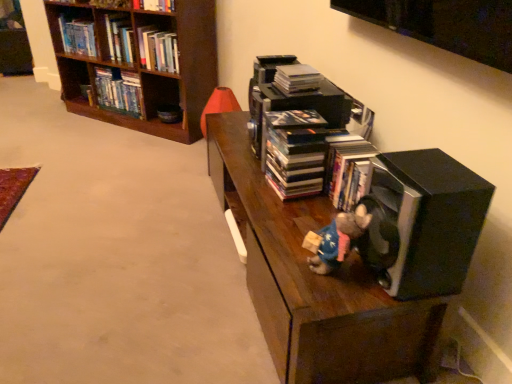
Find the location of a particular element. This screenshot has height=384, width=512. black matte book at center, positioned as the 4th book in top-to-bottom order is located at coordinates (303, 152).

At what (x,y) coordinates should I click in order to perform the action: click on hardcover book at upper left, the second book from the front. Please return your answer as a coordinate pair (x, y). This screenshot has height=384, width=512. Looking at the image, I should click on (158, 50).

What do you see at coordinates (78, 36) in the screenshot? This screenshot has width=512, height=384. I see `hardcover book at upper left, the 1th book positioned from the left` at bounding box center [78, 36].

How much space does hardcover books at left, which is counted as the second book, starting from the left, occupy horizontally?

hardcover books at left, which is counted as the second book, starting from the left, is 20.45 centimeters in width.

Identify the location of hardcover books at left, positioned as the third book in front-to-back order. This screenshot has width=512, height=384. (119, 91).

What do you see at coordinates (316, 284) in the screenshot? This screenshot has height=384, width=512. I see `dark wood shelf at center` at bounding box center [316, 284].

The height and width of the screenshot is (384, 512). Describe the element at coordinates (338, 240) in the screenshot. I see `plush toy at center` at that location.

Identify the location of plush toy at center. Image resolution: width=512 pixels, height=384 pixels. [x=338, y=240].

In order to click on brown wooden bookcase at upper left in this screenshot , I will do `click(137, 62)`.

I want to click on black matte book at center, which appears as the first book when viewed from the right, so click(303, 152).

Does hardcover book at upper left, which is counted as the first book, starting from the back, lie behind hardcover book at upper left, which is counted as the 3th book, starting from the left?

Yes, hardcover book at upper left, which is counted as the first book, starting from the back, is behind hardcover book at upper left, which is counted as the 3th book, starting from the left.

Does hardcover book at upper left, which is counted as the first book, starting from the back, have a lesser width compared to hardcover book at upper left, the second book from the front?

Incorrect, the width of hardcover book at upper left, which is counted as the first book, starting from the back, is not less than that of hardcover book at upper left, the second book from the front.

Where is `the 2nd book counting from the right of the hardcover book at upper left, arranged as the fourth book when viewed from the front`? This screenshot has height=384, width=512. the 2nd book counting from the right of the hardcover book at upper left, arranged as the fourth book when viewed from the front is located at coordinates [x=158, y=50].

Looking at this image, can you confirm if hardcover book at upper left, which ranks as the 1th book in top-to-bottom order, is bigger than hardcover book at upper left, the second book from the front?

Correct, hardcover book at upper left, which ranks as the 1th book in top-to-bottom order, is larger in size than hardcover book at upper left, the second book from the front.

Does dark wood shelf at center have a lesser height compared to black matte speaker at lower right?

In fact, dark wood shelf at center may be taller than black matte speaker at lower right.

Do you think dark wood shelf at center is within black matte speaker at lower right, or outside of it?

dark wood shelf at center is outside black matte speaker at lower right.

Which object is closer to the camera, dark wood shelf at center or black matte speaker at lower right?

black matte speaker at lower right is more forward.

Is dark wood shelf at center to the left or to the right of black matte speaker at lower right in the image?

From the image, it's evident that dark wood shelf at center is to the left of black matte speaker at lower right.

Which is in front, point (129, 80) or point (445, 279)?

Point (445, 279)

Considering the relative sizes of brown wooden bookcase at upper left and black matte speaker at lower right in the image provided, is brown wooden bookcase at upper left shorter than black matte speaker at lower right?

No, brown wooden bookcase at upper left is not shorter than black matte speaker at lower right.

From a real-world perspective, is brown wooden bookcase at upper left physically located above or below black matte speaker at lower right?

From a real-world perspective, brown wooden bookcase at upper left is physically below black matte speaker at lower right.

Is brown wooden bookcase at upper left facing towards black matte speaker at lower right?

No, brown wooden bookcase at upper left is not oriented towards black matte speaker at lower right.

Is black matte book at center, which is the 4th book in back-to-front order, not inside hardcover book at upper left, which is counted as the first book, starting from the back?

Yes, black matte book at center, which is the 4th book in back-to-front order, is located beyond the bounds of hardcover book at upper left, which is counted as the first book, starting from the back.

Can you confirm if black matte book at center, which is the fourth book in left-to-right order, is smaller than hardcover book at upper left, which ranks as the 4th book in right-to-left order?

Yes, black matte book at center, which is the fourth book in left-to-right order, is smaller than hardcover book at upper left, which ranks as the 4th book in right-to-left order.

From a real-world perspective, is black matte book at center, which is the fourth book in left-to-right order, positioned over hardcover book at upper left, which ranks as the 4th book in right-to-left order, based on gravity?

No.

Image resolution: width=512 pixels, height=384 pixels. I want to click on book that is the 3rd object located behind the black matte book at center, positioned as the 4th book in top-to-bottom order, so click(x=78, y=36).

Which is further, (86, 41) or (404, 319)?

The point (86, 41) is more distant.

Could you measure the distance between hardcover book at upper left, which ranks as the 4th book in right-to-left order, and dark wood shelf at center?

The distance of hardcover book at upper left, which ranks as the 4th book in right-to-left order, from dark wood shelf at center is 2.10 meters.

Between hardcover book at upper left, the fourth book ordered from the bottom, and dark wood shelf at center, which one has larger size?

dark wood shelf at center.

Is hardcover book at upper left, the 1th book positioned from the left, placed right next to dark wood shelf at center?

hardcover book at upper left, the 1th book positioned from the left, is not next to dark wood shelf at center, and they're not touching.

Is plush toy at center closer to camera compared to dark wood shelf at center?

Yes.

Does plush toy at center appear on the left side of dark wood shelf at center?

Incorrect, plush toy at center is not on the left side of dark wood shelf at center.

Can you confirm if plush toy at center is bigger than dark wood shelf at center?

No.

Considering the points (347, 237) and (306, 217), which point is in front, point (347, 237) or point (306, 217)?

The point (347, 237) is closer.

How much distance is there between hardcover books at left, positioned as the third book in front-to-back order, and hardcover book at upper left, the 3th book when ordered from bottom to top?

hardcover books at left, positioned as the third book in front-to-back order, and hardcover book at upper left, the 3th book when ordered from bottom to top, are 12.68 inches apart from each other.

Which point is more forward, (108, 87) or (178, 65)?

The point (178, 65) is closer.

From the picture: Would you say hardcover books at left, the second book when ordered from bottom to top, contains hardcover book at upper left, the second book from the front?

No, hardcover book at upper left, the second book from the front, is not surrounded by hardcover books at left, the second book when ordered from bottom to top.

Is hardcover books at left, the third book viewed from the right, not close to hardcover book at upper left, the second book in the top-to-bottom sequence?

They are positioned close to each other.

Locate an element on the screen. Image resolution: width=512 pixels, height=384 pixels. the 2nd book to the right of the hardcover book at upper left, the 1th book positioned from the left, starting your count from the anchor is located at coordinates (158, 50).

Where is `speaker above the dark wood shelf at center (from a real-world perspective)`? The width and height of the screenshot is (512, 384). speaker above the dark wood shelf at center (from a real-world perspective) is located at coordinates (423, 222).

From the image, which object appears to be nearer to black matte book at center, the first book from the bottom, brown wooden bookcase at upper left or black matte speaker at lower right?

black matte speaker at lower right is closer to black matte book at center, the first book from the bottom.

Estimate the real-world distances between objects in this image. Which object is closer to black matte book at center, which is the fourth book in left-to-right order, hardcover book at upper left, the 1th book positioned from the left, or black matte speaker at lower right?

black matte speaker at lower right is positioned closer to the anchor black matte book at center, which is the fourth book in left-to-right order.

When comparing their distances from hardcover books at left, the third book viewed from the right, does black matte speaker at lower right or plush toy at center seem closer?

Among the two, plush toy at center is located nearer to hardcover books at left, the third book viewed from the right.

Based on their spatial positions, is hardcover books at left, which is counted as the second book, starting from the left, or hardcover book at upper left, which ranks as the 1th book in top-to-bottom order, further from black matte book at center, the first book from the front?

Based on the image, hardcover book at upper left, which ranks as the 1th book in top-to-bottom order, appears to be further to black matte book at center, the first book from the front.

Based on their spatial positions, is plush toy at center or dark wood shelf at center further from hardcover book at upper left, arranged as the fourth book when viewed from the front?

The object further to hardcover book at upper left, arranged as the fourth book when viewed from the front, is plush toy at center.

When comparing their distances from hardcover book at upper left, which is counted as the 3th book, starting from the left, does black matte book at center, positioned as the 4th book in top-to-bottom order, or brown wooden bookcase at upper left seem closer?

The object closer to hardcover book at upper left, which is counted as the 3th book, starting from the left, is brown wooden bookcase at upper left.

Considering their positions, is dark wood shelf at center positioned closer to hardcover book at upper left, which is counted as the 3th book, starting from the left, than black matte speaker at lower right?

dark wood shelf at center is positioned closer to the anchor hardcover book at upper left, which is counted as the 3th book, starting from the left.

Looking at the image, which one is located closer to hardcover books at left, the second book when ordered from bottom to top, black matte book at center, positioned as the 4th book in top-to-bottom order, or dark wood shelf at center?

dark wood shelf at center.

Locate an element on the screen. shelf between black matte speaker at lower right and hardcover book at upper left, arranged as the fourth book when viewed from the front, along the z-axis is located at coordinates (316, 284).

The width and height of the screenshot is (512, 384). Identify the location of shelf between plush toy at center and brown wooden bookcase at upper left along the z-axis. (316, 284).

At what (x,y) coordinates should I click in order to perform the action: click on book between hardcover book at upper left, which ranks as the 4th book in right-to-left order, and hardcover book at upper left, which is the 3th book from back to front. Please return your answer as a coordinate pair (x, y). Looking at the image, I should click on (119, 91).

The width and height of the screenshot is (512, 384). What are the coordinates of `figurine between black matte speaker at lower right and brown wooden bookcase at upper left along the z-axis` in the screenshot? It's located at (338, 240).